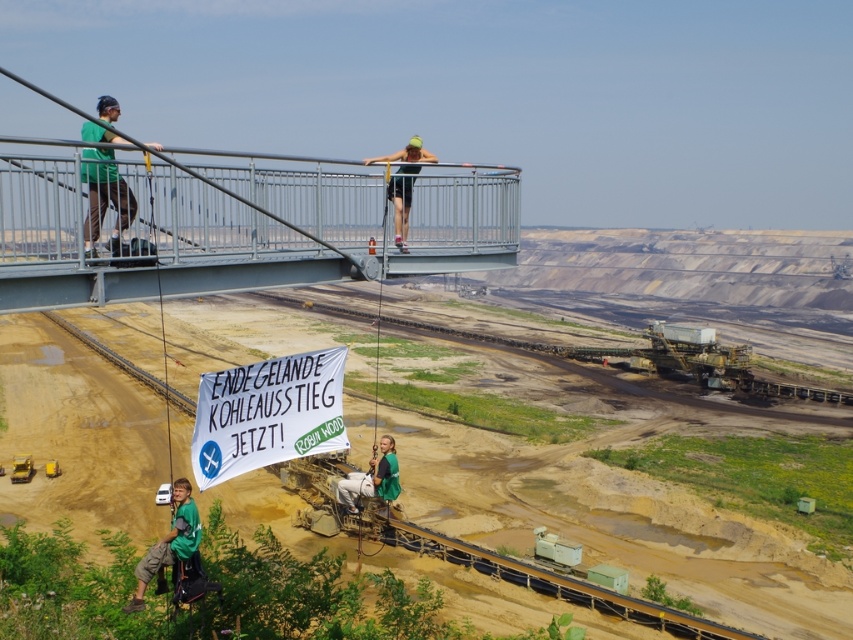
Question: Which of these objects is positioned closest to the green fabric at lower center?

Choices:
 (A) green matte shirt at left
 (B) metallic gray pedestrian bridge at upper center

Answer: (B)

Question: Can you confirm if green matte shirt at left is bigger than green matte shirt at lower left?

Choices:
 (A) no
 (B) yes

Answer: (B)

Question: Which point appears farthest from the camera in this image?

Choices:
 (A) (184, 502)
 (B) (90, 180)

Answer: (B)

Question: Which of the following is the closest to the observer?

Choices:
 (A) (405, 156)
 (B) (45, 184)
 (C) (370, 458)
 (D) (103, 131)

Answer: (B)

Question: Is white fabric banner at center behind green matte shirt at lower left?

Choices:
 (A) yes
 (B) no

Answer: (A)

Question: Considering the relative positions of metallic gray pedestrian bridge at upper center and green fabric at lower center in the image provided, where is metallic gray pedestrian bridge at upper center located with respect to green fabric at lower center?

Choices:
 (A) right
 (B) left

Answer: (B)